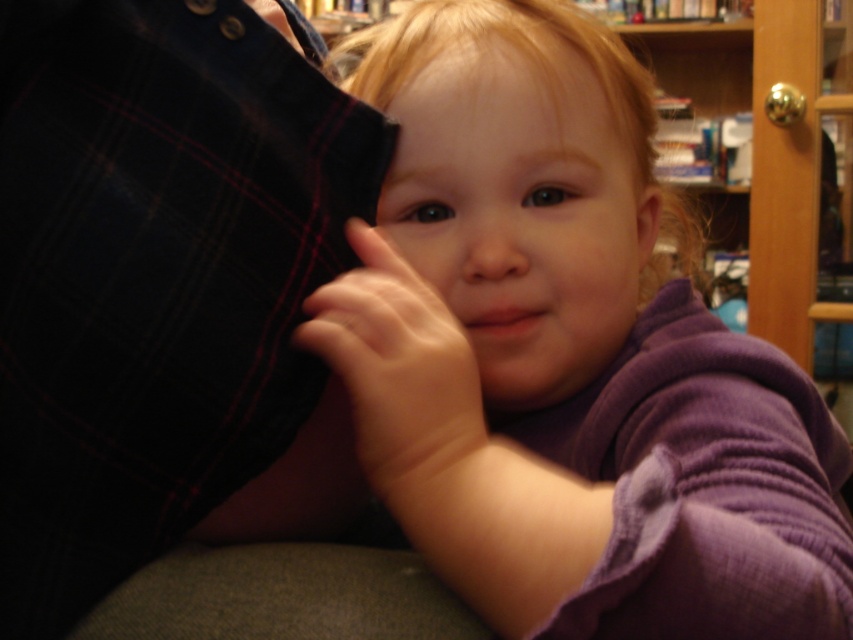
Question: Is purple soft fabric baby at center wider than smooth skin hand at center?

Choices:
 (A) yes
 (B) no

Answer: (A)

Question: Is purple soft fabric baby at center above smooth skin hand at center?

Choices:
 (A) no
 (B) yes

Answer: (B)

Question: Among these points, which one is nearest to the camera?

Choices:
 (A) (345, 321)
 (B) (569, 164)

Answer: (A)

Question: Among these objects, which one is nearest to the camera?

Choices:
 (A) smooth skin hand at center
 (B) purple soft fabric baby at center

Answer: (B)

Question: Does purple soft fabric baby at center appear on the right side of smooth skin hand at center?

Choices:
 (A) yes
 (B) no

Answer: (A)

Question: Which point is farther to the camera?

Choices:
 (A) purple soft fabric baby at center
 (B) smooth skin hand at center

Answer: (B)